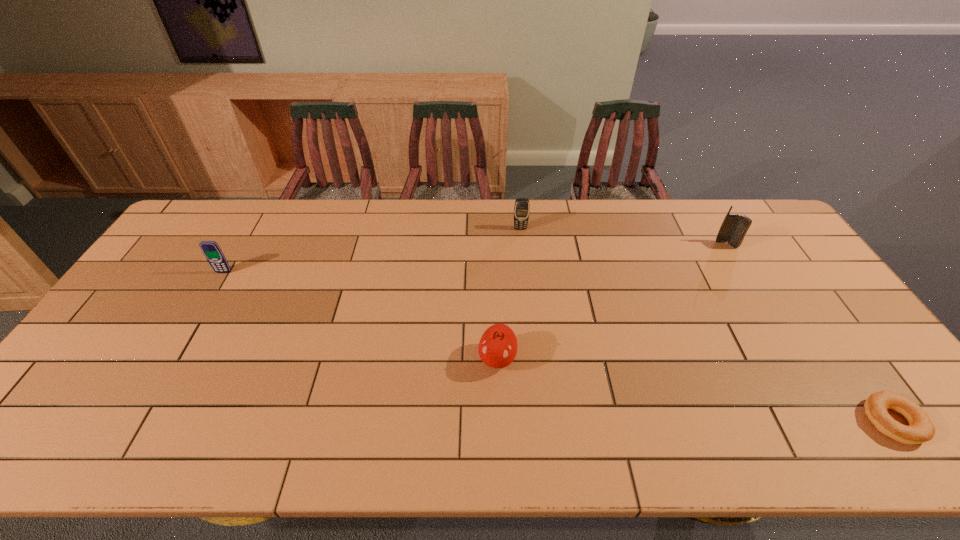
In the image, there is a desktop. Find the location of `free space at the left edge`. free space at the left edge is located at coordinates (113, 321).

The height and width of the screenshot is (540, 960). In order to click on blank space at the right edge of the desktop in this screenshot , I will do `click(773, 262)`.

Where is `free space between the bagel and the second object from right to left`? This screenshot has height=540, width=960. free space between the bagel and the second object from right to left is located at coordinates (809, 333).

The width and height of the screenshot is (960, 540). Find the location of `free space between the second cellular telephone from left to right and the second farthest object`. free space between the second cellular telephone from left to right and the second farthest object is located at coordinates (623, 237).

Where is `free space between the farthest cellular telephone and the second object from left to right`? free space between the farthest cellular telephone and the second object from left to right is located at coordinates (509, 293).

The image size is (960, 540). Find the location of `unoccupied position between the shortest object and the leftmost object`. unoccupied position between the shortest object and the leftmost object is located at coordinates click(x=558, y=347).

This screenshot has height=540, width=960. I want to click on free area in between the second object from left to right and the farthest cellular telephone, so click(509, 293).

Identify the location of empty space that is in between the third object from left to right and the bagel. The height and width of the screenshot is (540, 960). (706, 325).

Locate an element on the screen. This screenshot has height=540, width=960. free spot between the shortest object and the third nearest object is located at coordinates (558, 347).

Where is `vacant region between the shortest object and the leftmost cellular telephone`? vacant region between the shortest object and the leftmost cellular telephone is located at coordinates (558, 347).